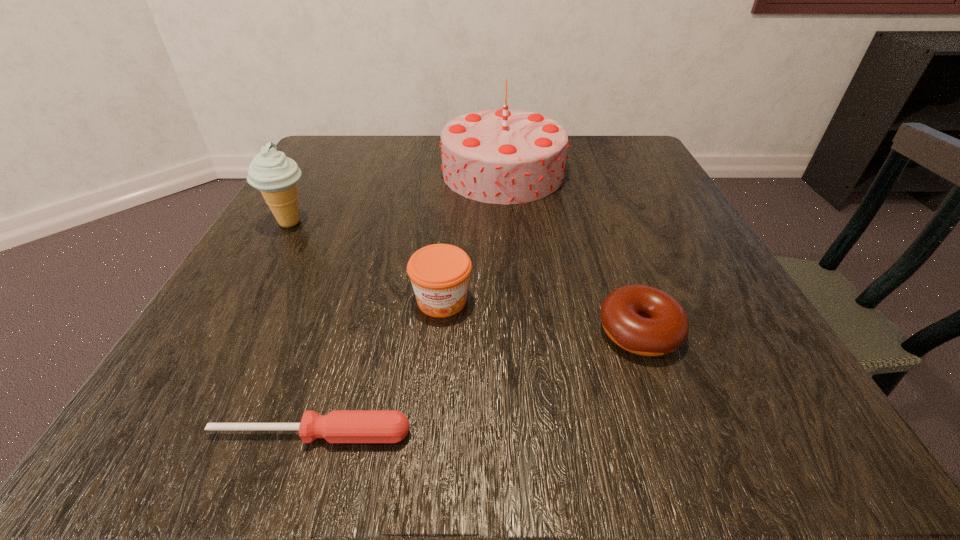
Locate an element on the screen. free space located on the front label of the third tallest object is located at coordinates (428, 446).

Where is `vacant area located on the back of the doughnut`? This screenshot has width=960, height=540. vacant area located on the back of the doughnut is located at coordinates click(x=608, y=245).

Where is `vacant region located 0.340m on the back of the screwdriver`? This screenshot has height=540, width=960. vacant region located 0.340m on the back of the screwdriver is located at coordinates (372, 241).

This screenshot has height=540, width=960. Identify the location of object at the far edge. (505, 156).

Image resolution: width=960 pixels, height=540 pixels. Find the location of `object located in the near edge section of the desktop`. object located in the near edge section of the desktop is located at coordinates (339, 426).

Where is `icecream located in the left edge section of the desktop`? icecream located in the left edge section of the desktop is located at coordinates (275, 175).

Identify the location of screwdriver located in the left edge section of the desktop. This screenshot has width=960, height=540. (339, 426).

The width and height of the screenshot is (960, 540). Identify the location of object located at the right edge. (644, 320).

Identify the location of object that is at the near left corner. (339, 426).

Where is `vacant space at the far edge of the desktop`? vacant space at the far edge of the desktop is located at coordinates (429, 172).